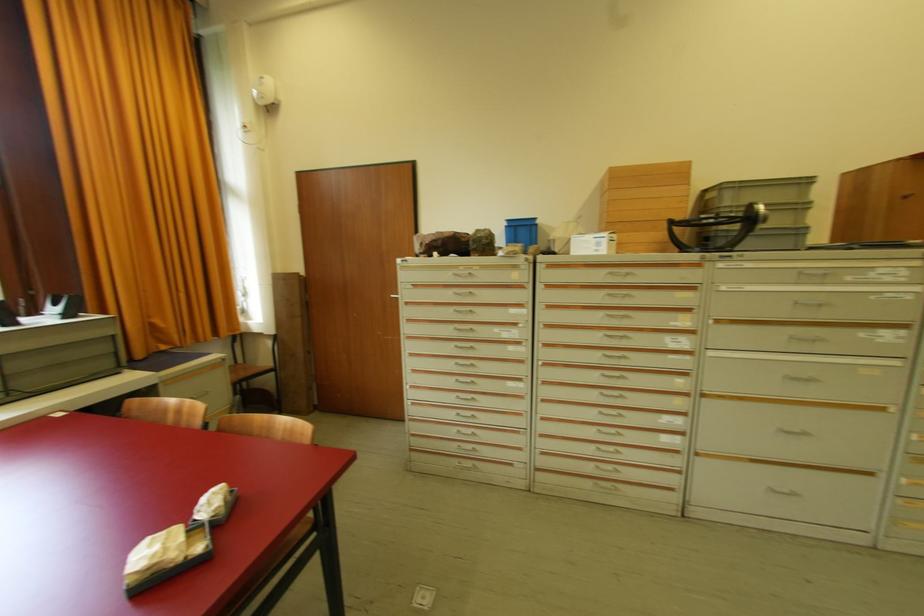
Find where to sit the chair sitting surface. Please return your answer as a coordinate pair (x, y).

(240, 371)